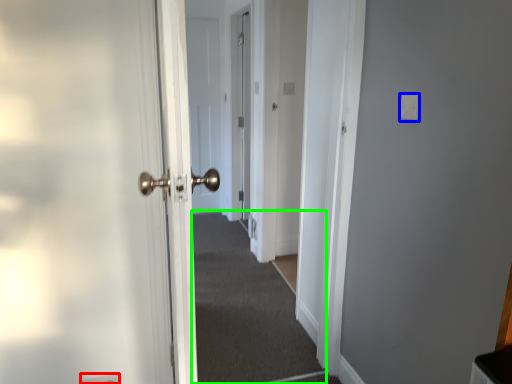
Question: Which object is positioned farthest from electric outlet (highlighted by a red box)? Select from light switch (highlighted by a blue box) and corridor (highlighted by a green box).

Choices:
 (A) light switch
 (B) corridor

Answer: (A)